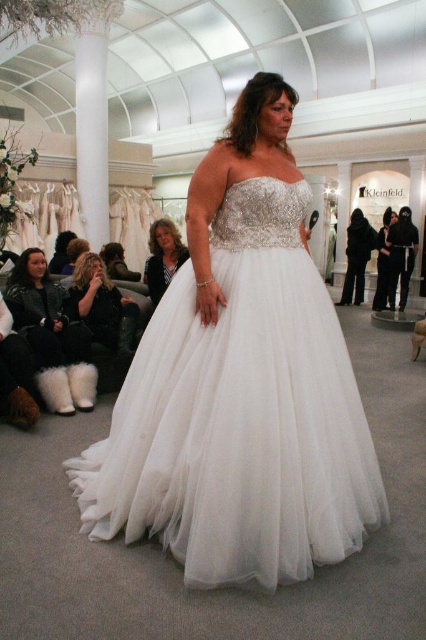
In the scene shown: You are standing in a bridal shop and want to try on the wedding dress displayed at the point labeled point (288, 536). If you are exactly 1.85 meters away from this point, can you comfortably reach the dress without moving closer?

The point (288, 536) is 1.85 meters away from you. Since the average comfortable reaching distance for most adults is around 1.5 to 2 meters, you can comfortably reach the dress without needing to move closer.

You are a customer in the bridal shop and want to try on both the white tulle dress at center and the fuzzy black boots at lower left. The store has a changing room that is 2 meters away from the entrance. Can you walk from the entrance to the changing room, pick up both items, and return to the entrance without needing to backtrack?

The white tulle dress at center and fuzzy black boots at lower left are 1.83 meters apart. Since the changing room is 2 meters from the entrance, you can reach both items within the 2 meter distance and return without backtracking.